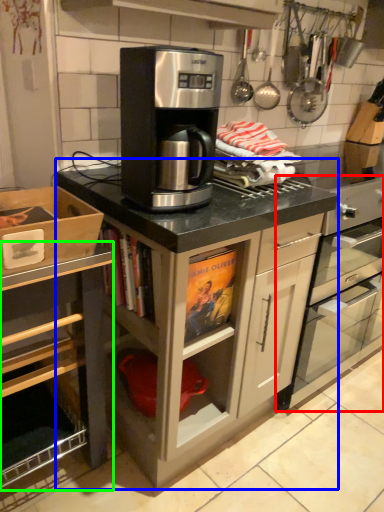
Question: Which is nearer to the home appliance (highlighted by a red box)? cabinetry (highlighted by a blue box) or cabinetry (highlighted by a green box).

Choices:
 (A) cabinetry
 (B) cabinetry

Answer: (A)